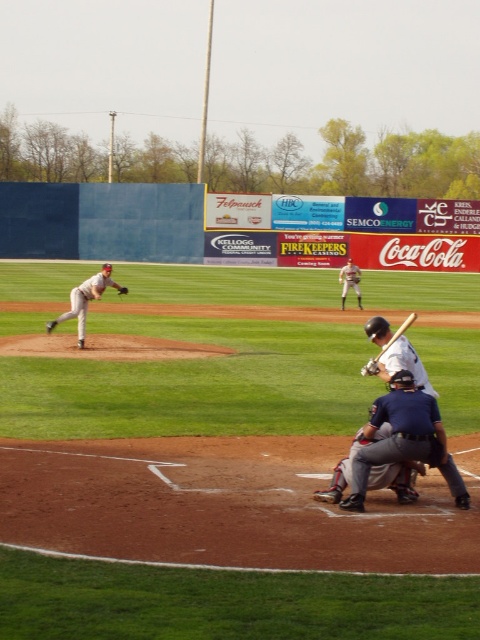
You are a drone operator trying to capture the best shot of the baseball game. The gray uniformed pitcher at left is your focus. Where should you position your drone to get a clear view of the pitcher?

The gray uniformed pitcher at left is located at point (x=84, y=300), so you should position the drone near that coordinate to capture a clear view of the pitcher.